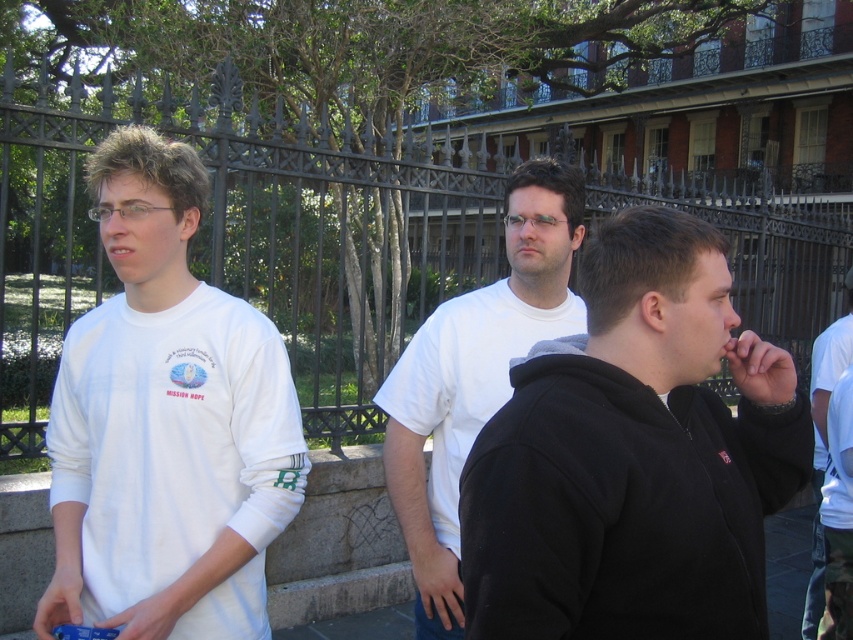
Between white matte long-sleeve shirt at left and white cotton t-shirt at center, which one is positioned higher?

white matte long-sleeve shirt at left is higher up.

Between point (267, 394) and point (554, 308), which one is positioned in front?

Positioned in front is point (267, 394).

Is point (65, 570) positioned behind point (573, 209)?

No, it is not.

The image size is (853, 640). Find the location of `white matte long-sleeve shirt at left`. white matte long-sleeve shirt at left is located at coordinates (166, 422).

Is white matte long-sleeve shirt at left to the left of white t-shirt at center from the viewer's perspective?

Yes, white matte long-sleeve shirt at left is to the left of white t-shirt at center.

This screenshot has height=640, width=853. What do you see at coordinates (166, 422) in the screenshot? I see `white matte long-sleeve shirt at left` at bounding box center [166, 422].

What are the coordinates of `white matte long-sleeve shirt at left` in the screenshot? It's located at (166, 422).

Between black fleece jacket at center and white cotton t-shirt at center, which one appears on the right side from the viewer's perspective?

black fleece jacket at center

Between black fleece jacket at center and white cotton t-shirt at center, which one has less height?

black fleece jacket at center

Between point (659, 621) and point (572, 208), which one is positioned in front?

Point (659, 621) is more forward.

Find the location of a particular element. The height and width of the screenshot is (640, 853). black fleece jacket at center is located at coordinates (634, 456).